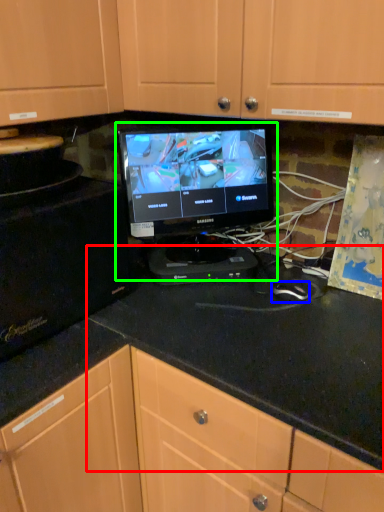
Question: Which object is the farthest from counter top (highlighted by a red box)? Choose among these: mouse (highlighted by a blue box) or computer monitor (highlighted by a green box).

Choices:
 (A) mouse
 (B) computer monitor

Answer: (B)